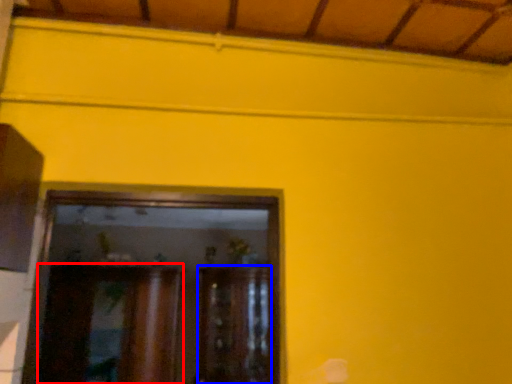
Question: Which object appears farthest to the camera in this image, cabinetry (highlighted by a red box) or cabinetry (highlighted by a blue box)?

Choices:
 (A) cabinetry
 (B) cabinetry

Answer: (B)